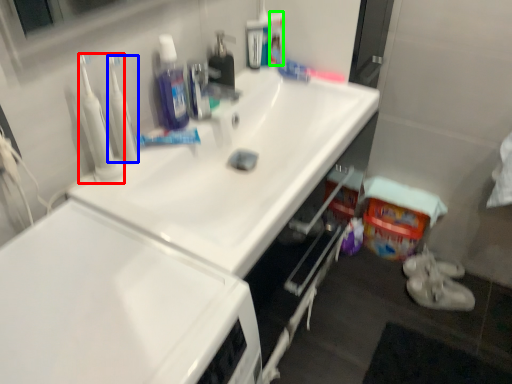
Question: Which is farther away from cleanser (highlighted by a red box)? cleanser (highlighted by a blue box) or cleaning products (highlighted by a green box)?

Choices:
 (A) cleanser
 (B) cleaning products

Answer: (B)